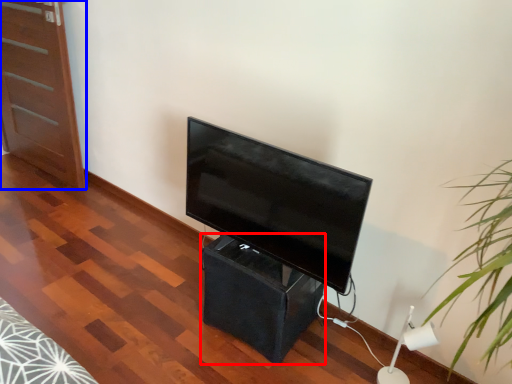
Question: Among these objects, which one is farthest to the camera, table (highlighted by a red box) or furniture (highlighted by a blue box)?

Choices:
 (A) table
 (B) furniture

Answer: (B)